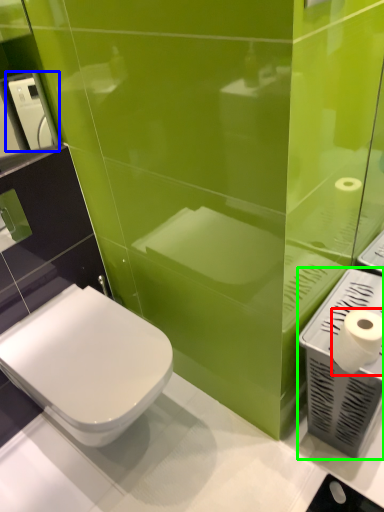
Question: Which object is positioned closest to toilet paper (highlighted by a red box)? Select from hand dryer (highlighted by a blue box) and hand dryer (highlighted by a green box).

Choices:
 (A) hand dryer
 (B) hand dryer

Answer: (B)